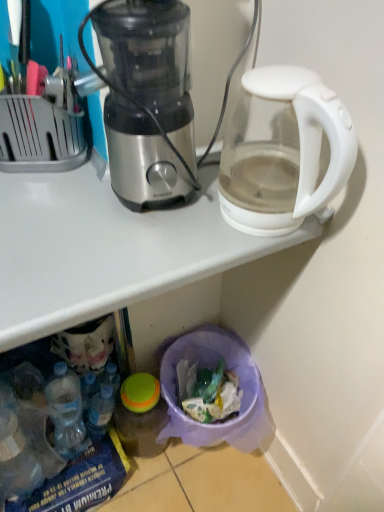
Locate an element on the screen. free spot to the left of stainless steel blender at center is located at coordinates (51, 205).